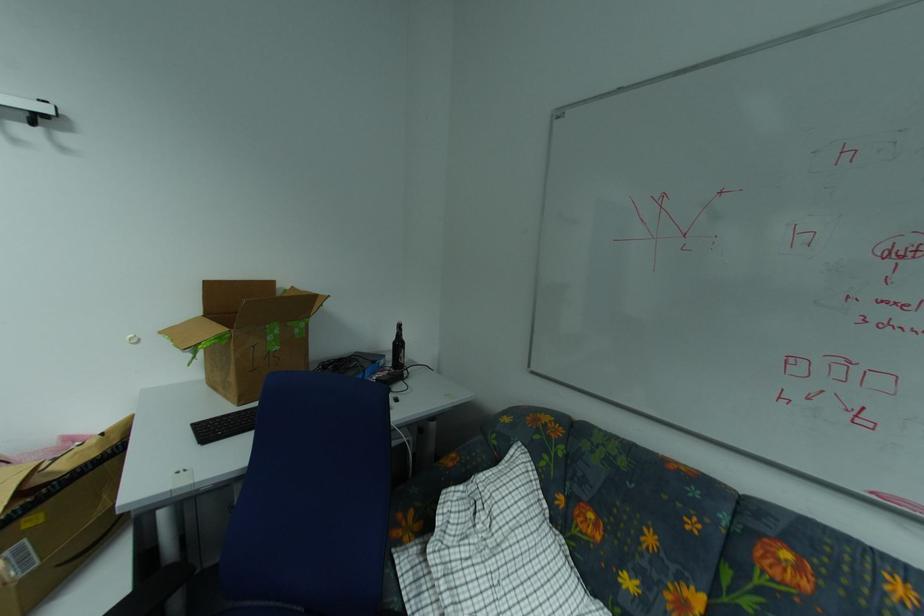
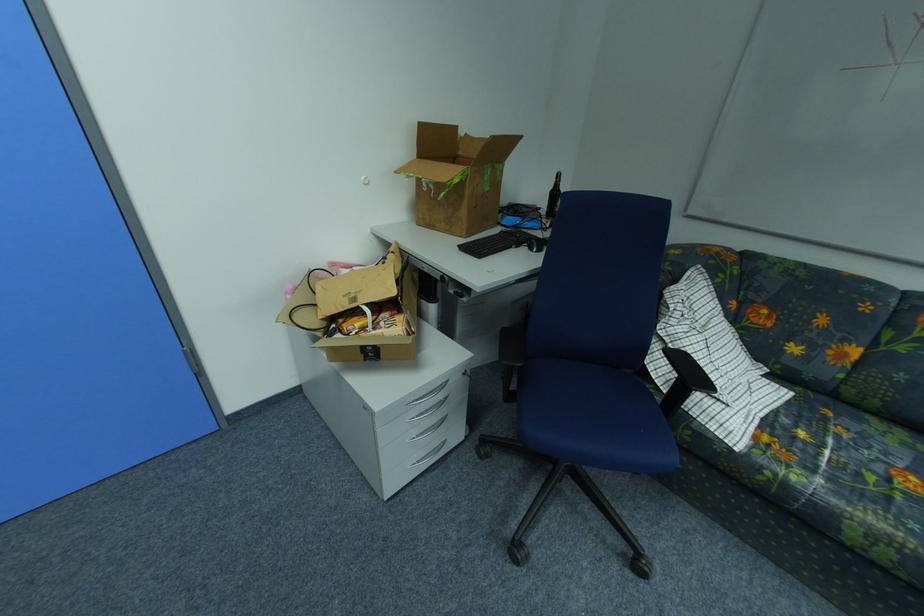
Question: The images are taken continuously from a first-person perspective. In which direction are you moving?

Choices:
 (A) Left
 (B) Right
 (C) Forward
 (D) Backward

Answer: (A)